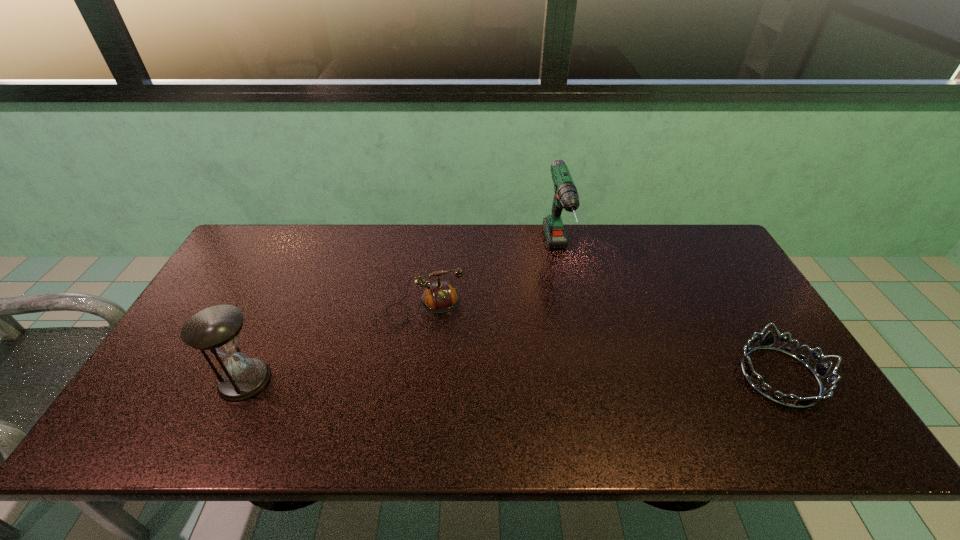
Locate an element on the screen. The height and width of the screenshot is (540, 960). empty location between the tallest object and the third shortest object is located at coordinates (401, 317).

This screenshot has height=540, width=960. Identify the location of free spot between the second object from right to left and the tiara. (669, 315).

The width and height of the screenshot is (960, 540). In order to click on empty space that is in between the leftmost object and the rightmost object in this screenshot , I will do `click(513, 379)`.

At what (x,y) coordinates should I click in order to perform the action: click on free space between the second shortest object and the tiara. Please return your answer as a coordinate pair (x, y). The width and height of the screenshot is (960, 540). Looking at the image, I should click on (600, 342).

Where is `empty space that is in between the rightmost object and the telephone`? Image resolution: width=960 pixels, height=540 pixels. empty space that is in between the rightmost object and the telephone is located at coordinates (600, 342).

The width and height of the screenshot is (960, 540). I want to click on vacant area that lies between the telephone and the rightmost object, so click(600, 342).

The width and height of the screenshot is (960, 540). I want to click on free space between the rightmost object and the telephone, so click(x=600, y=342).

Locate which object is the closest to the second farthest object. Please provide its 2D coordinates. Your answer should be formatted as a tuple, i.e. [(x, y)], where the tuple contains the x and y coordinates of a point satisfying the conditions above.

[(216, 329)]

Identify which object is the third closest to the telephone. Please provide its 2D coordinates. Your answer should be formatted as a tuple, i.e. [(x, y)], where the tuple contains the x and y coordinates of a point satisfying the conditions above.

[(820, 370)]

The width and height of the screenshot is (960, 540). Find the location of `vacant space that satisfies the following two spatial constraints: 1. on the front side of the shortest object; 2. on the front-facing side of the telephone`. vacant space that satisfies the following two spatial constraints: 1. on the front side of the shortest object; 2. on the front-facing side of the telephone is located at coordinates (411, 376).